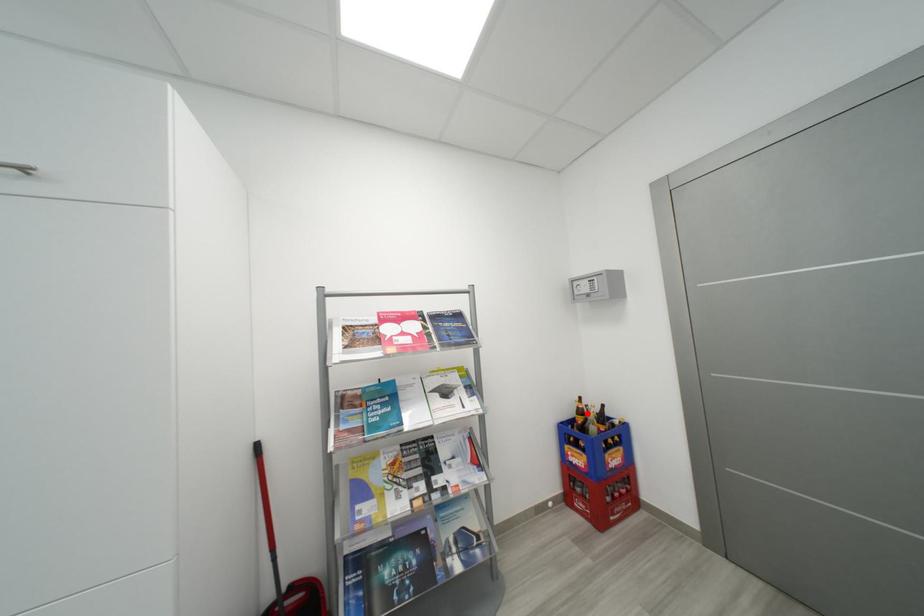
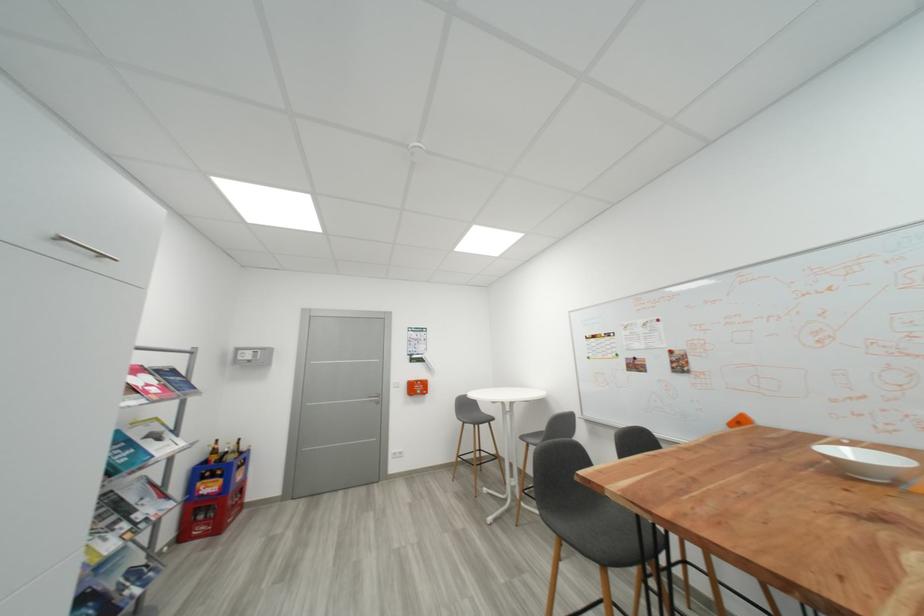
Find the pixel in the second image that matches the highlighted location in the first image.

(223, 454)